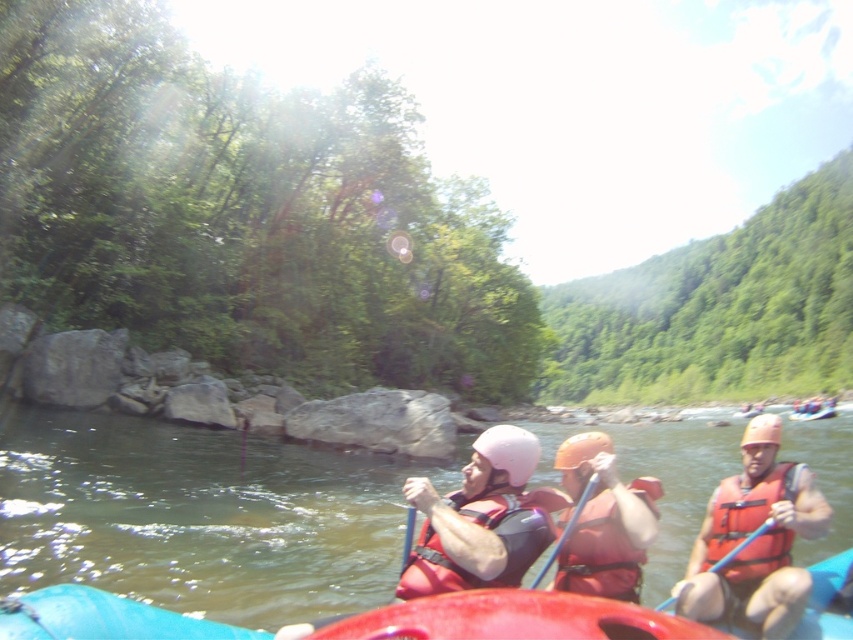
You are a photographer trying to capture the rafters in the red raft. You notice two points in the scene, point (747, 611) and point (643, 497). If you want to focus on the point that is closer to the camera, which coordinate should you choose?

Point (643, 497) is closer to the camera than point (747, 611), so you should choose point (643, 497) to focus on.

You are a photographer taking a picture of the orange life jacket at center and the blue plastic paddle at center. Which object should you focus on first if you want to capture both in sharp focus?

The orange life jacket at center is located below the blue plastic paddle at center. Since they are both at the center, you should focus on the orange life jacket at center first because it is closer to the camera, ensuring both are in focus when using depth of field techniques.

You are a safety inspector checking the gear of rafters. You notice the orange life vest at right and the red life jacket at center. Which one is taller?

The orange life vest at right is taller than the red life jacket at center.